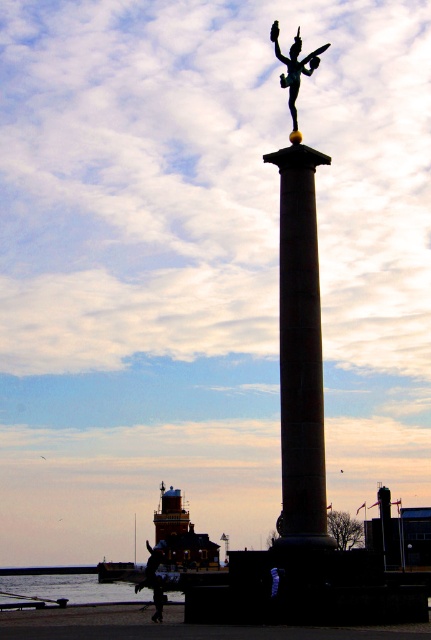
You are a photographer trying to capture the statue on top of the column. You notice two elements in the foreground that might interfere with your shot. Which object is closer to you, the transparent water at lower left or the dark skin smooth person at lower center?

The transparent water at lower left is closer to you because the dark skin smooth person at lower center is behind it.

You are a photographer standing at the base of the column and want to capture both the transparent water at lower left and the dark skin smooth person at lower center in the same frame. Which object should you focus on first to ensure both are in the shot?

The transparent water at lower left is below the dark skin smooth person at lower center, so you should focus on the dark skin smooth person at lower center first to ensure both are in the frame.

You are standing at the base of the tall column structure and want to take a photo of the statue on top. There are two points marked in the image at coordinates point [105,584] and point [156,598]. Which point should you stand behind to ensure the statue is fully visible without obstruction?

You should stand behind point [156,598] because point [105,584] is behind it, which might block the view of the statue.